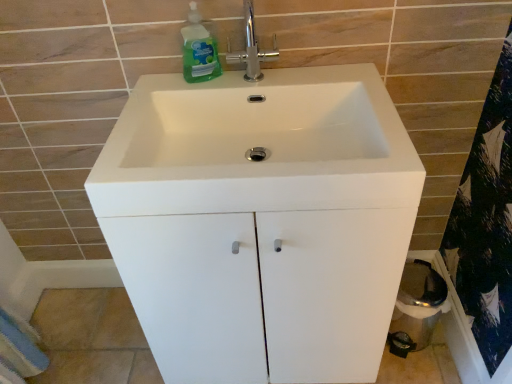
At what (x,y) coordinates should I click in order to perform the action: click on unoccupied region to the right of blue textured bath towel at lower left. Please return your answer as a coordinate pair (x, y). This screenshot has height=384, width=512. Looking at the image, I should click on (78, 331).